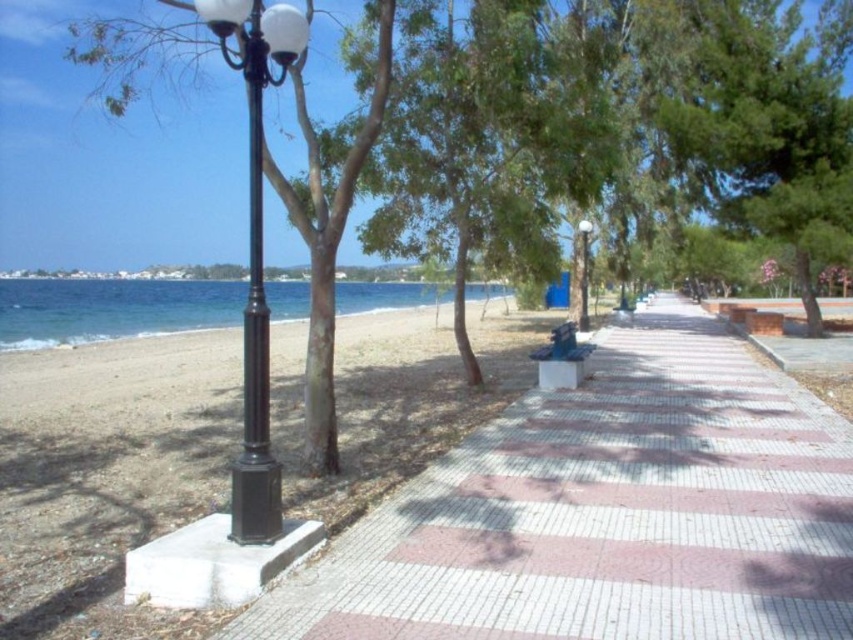
Can you confirm if white tile pavement at center is wider than black metal pole at left?

Yes, white tile pavement at center is wider than black metal pole at left.

Is white tile pavement at center behind black metal pole at left?

No.

Is point (440, 564) in front of point (231, 468)?

Yes, point (440, 564) is closer to viewer.

Identify the location of white tile pavement at center. This screenshot has height=640, width=853. (607, 513).

Between blue water at lower left and black polished metal street light at left, which one is positioned higher?

blue water at lower left is higher up.

The image size is (853, 640). What do you see at coordinates (111, 308) in the screenshot? I see `blue water at lower left` at bounding box center [111, 308].

Find the location of `blue water at lower left`. blue water at lower left is located at coordinates (111, 308).

Does blue water at lower left appear on the left side of black metal street light at center?

Indeed, blue water at lower left is positioned on the left side of black metal street light at center.

Who is positioned more to the right, blue water at lower left or black metal street light at center?

From the viewer's perspective, black metal street light at center appears more on the right side.

I want to click on blue water at lower left, so tap(111, 308).